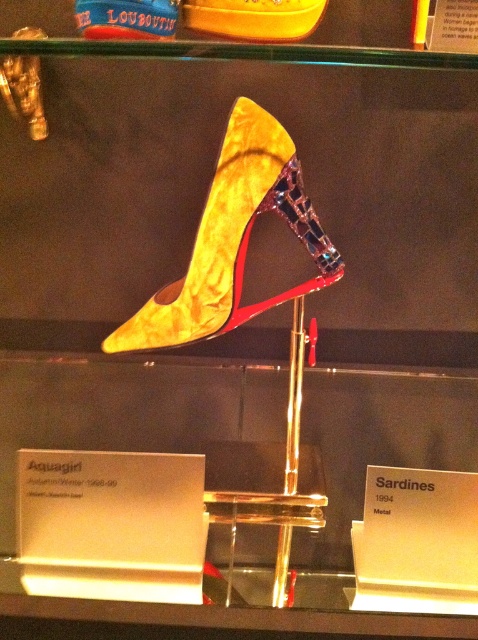
Question: Which object is closer to the camera taking this photo?

Choices:
 (A) shiny gold shoe at upper center
 (B) velvet gold shoe at center
 (C) shiny gold high-heeled shoe at center

Answer: (C)

Question: Which of the following is the closest to the observer?

Choices:
 (A) shiny gold high-heeled shoe at center
 (B) shiny gold shoe at upper center
 (C) velvet gold shoe at center

Answer: (A)

Question: Is velvet gold shoe at center bigger than shiny gold shoe at upper center?

Choices:
 (A) no
 (B) yes

Answer: (B)

Question: Does velvet gold shoe at center appear on the left side of shiny gold shoe at upper center?

Choices:
 (A) no
 (B) yes

Answer: (B)

Question: Estimate the real-world distances between objects in this image. Which object is closer to the shiny gold shoe at upper center?

Choices:
 (A) velvet gold shoe at center
 (B) shiny gold high-heeled shoe at center

Answer: (B)

Question: Does shiny gold shoe at upper center have a larger size compared to shiny gold high-heeled shoe at center?

Choices:
 (A) no
 (B) yes

Answer: (A)